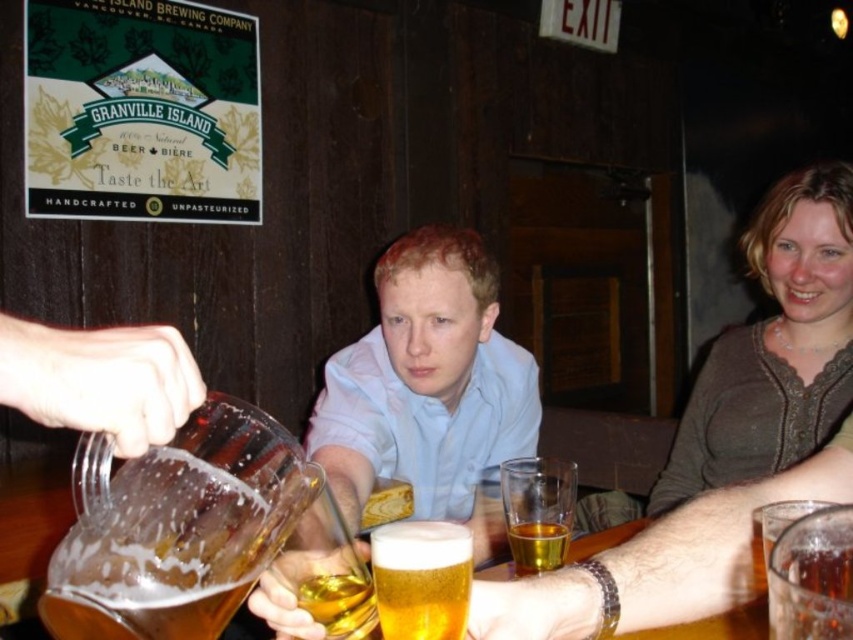
Question: Among these objects, which one is nearest to the camera?

Choices:
 (A) translucent plastic cup at center
 (B) golden liquid beer at center
 (C) matte brown sweater at upper right
 (D) matte glass mug at center

Answer: (D)

Question: Does translucent glass mug at center have a greater width compared to translucent glass mug at lower right?

Choices:
 (A) no
 (B) yes

Answer: (B)

Question: Among these objects, which one is nearest to the camera?

Choices:
 (A) translucent glass mug at center
 (B) matte glass mug at center
 (C) amber glass at center
 (D) foamy golden beer at center

Answer: (D)

Question: Does matte glass mug at center have a lesser width compared to foamy golden beer at center?

Choices:
 (A) yes
 (B) no

Answer: (B)

Question: Among these objects, which one is nearest to the camera?

Choices:
 (A) foamy amber glass at center
 (B) foamy golden beer at center

Answer: (A)

Question: Does matte brown sweater at upper right have a larger size compared to amber glass at center?

Choices:
 (A) no
 (B) yes

Answer: (B)